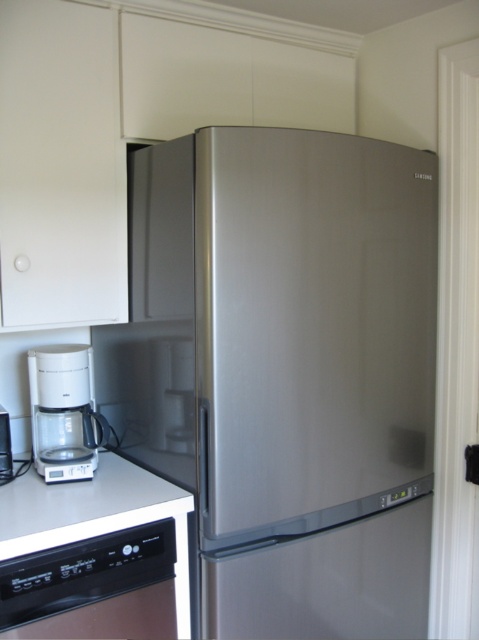
Question: Does black glossy oven at lower left appear under white glossy countertop at lower left?

Choices:
 (A) no
 (B) yes

Answer: (B)

Question: Which of the following is the closest to the observer?

Choices:
 (A) white glossy countertop at lower left
 (B) white plastic coffee maker at lower left
 (C) black glossy oven at lower left
 (D) stainless steel refrigerator at center

Answer: (A)

Question: Does stainless steel refrigerator at center have a greater width compared to black glossy oven at lower left?

Choices:
 (A) yes
 (B) no

Answer: (A)

Question: Which of the following is the farthest from the observer?

Choices:
 (A) (373, 244)
 (B) (87, 390)

Answer: (B)

Question: Among these objects, which one is farthest from the camera?

Choices:
 (A) stainless steel refrigerator at center
 (B) white plastic coffee maker at lower left
 (C) white glossy countertop at lower left

Answer: (B)

Question: Where is black glossy oven at lower left located in relation to white glossy countertop at lower left in the image?

Choices:
 (A) left
 (B) right

Answer: (B)